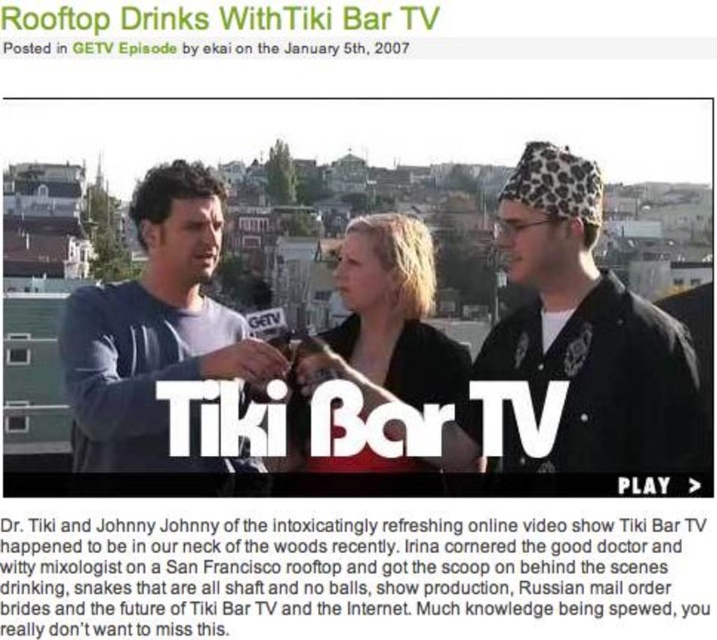
Question: Which object is the farthest from the leopard print hat at upper right?

Choices:
 (A) black paper text at center
 (B) blonde hair at center

Answer: (A)

Question: Is leopard print hat at upper right wider than matte blue shirt at center?

Choices:
 (A) yes
 (B) no

Answer: (A)

Question: Which point appears closest to the camera in this image?

Choices:
 (A) (255, 612)
 (B) (191, 308)
 (C) (640, 422)
 (D) (384, 227)

Answer: (A)

Question: Observing the image, what is the correct spatial positioning of leopard print hat at upper right in reference to blonde hair at center?

Choices:
 (A) above
 (B) below

Answer: (A)

Question: Which object appears farthest from the camera in this image?

Choices:
 (A) leopard print hat at upper right
 (B) blonde hair at center
 (C) black paper text at center
 (D) matte blue shirt at center

Answer: (B)

Question: Does matte blue shirt at center appear over blonde hair at center?

Choices:
 (A) yes
 (B) no

Answer: (B)